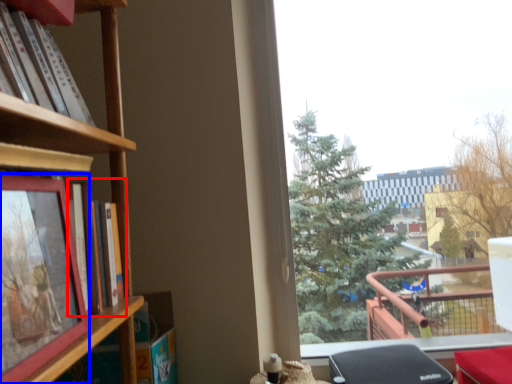
Question: Which object appears closest to the camera in this image, book (highlighted by a red box) or picture frame (highlighted by a blue box)?

Choices:
 (A) book
 (B) picture frame

Answer: (B)